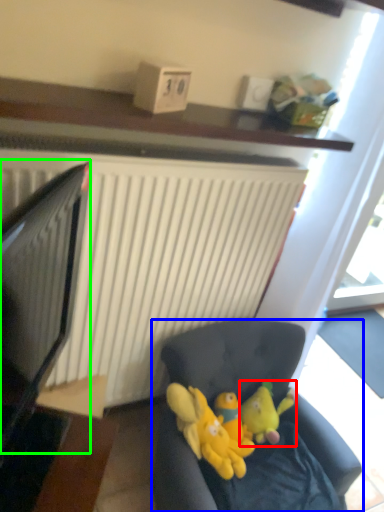
Question: Estimate the real-world distances between objects in this image. Which object is farther from toy (highlighted by a red box), studio couch (highlighted by a blue box) or computer monitor (highlighted by a green box)?

Choices:
 (A) studio couch
 (B) computer monitor

Answer: (B)